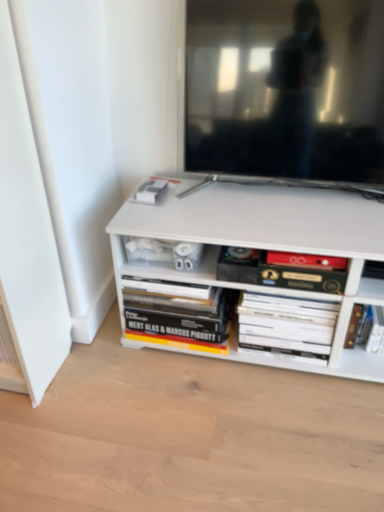
Question: Is matte black tv at upper center outside hardcover book at center, which is the 2th book from left to right?

Choices:
 (A) yes
 (B) no

Answer: (A)

Question: Can you confirm if matte black tv at upper center is bigger than hardcover book at center, which is the 2th book from left to right?

Choices:
 (A) no
 (B) yes

Answer: (B)

Question: From a real-world perspective, is matte black tv at upper center located beneath hardcover book at center, which is the 2th book from left to right?

Choices:
 (A) yes
 (B) no

Answer: (B)

Question: From a real-world perspective, is matte black tv at upper center physically above hardcover book at center, which is the third book in right-to-left order?

Choices:
 (A) yes
 (B) no

Answer: (A)

Question: Is hardcover book at center, which is the third book in right-to-left order, located within matte black tv at upper center?

Choices:
 (A) yes
 (B) no

Answer: (B)

Question: Does matte black tv at upper center have a smaller size compared to hardcover book at center, which is the 2th book from left to right?

Choices:
 (A) yes
 (B) no

Answer: (B)

Question: Is hardcover book at lower right, which is the 1th book in right-to-left order, turned away from hardcover book at lower center, which is the fourth book in right-to-left order?

Choices:
 (A) no
 (B) yes

Answer: (A)

Question: Is hardcover book at lower right, which is the 1th book in right-to-left order, to the right of hardcover book at lower center, which is the fourth book in right-to-left order, from the viewer's perspective?

Choices:
 (A) yes
 (B) no

Answer: (A)

Question: Could you tell me if hardcover book at lower right, positioned as the 4th book in left-to-right order, is facing hardcover book at lower center, which is the 1th book from left to right?

Choices:
 (A) no
 (B) yes

Answer: (A)

Question: Would you say hardcover book at lower right, which is the 1th book in right-to-left order, is outside hardcover book at lower center, which is the 1th book from left to right?

Choices:
 (A) yes
 (B) no

Answer: (A)

Question: Is hardcover book at lower right, which is the 1th book in right-to-left order, not close to hardcover book at lower center, which is the 1th book from left to right?

Choices:
 (A) no
 (B) yes

Answer: (A)

Question: Does hardcover book at lower right, which is the 1th book in right-to-left order, have a greater width compared to hardcover book at lower center, which is the fourth book in right-to-left order?

Choices:
 (A) yes
 (B) no

Answer: (B)

Question: Can you see hardcover book at center, which is the third book in right-to-left order, touching hardcover book at lower right, which is the 1th book in right-to-left order?

Choices:
 (A) no
 (B) yes

Answer: (A)